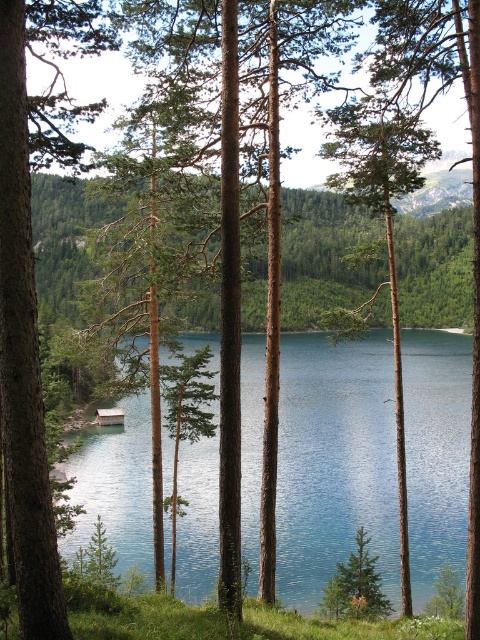
Question: Is green matte pine forest at center behind green rough bark tree at center?

Choices:
 (A) yes
 (B) no

Answer: (A)

Question: Does green matte pine forest at center appear on the right side of green rough bark tree at center?

Choices:
 (A) no
 (B) yes

Answer: (A)

Question: Which of the following is the closest to the observer?

Choices:
 (A) green matte pine forest at center
 (B) blue glassy water at center
 (C) green rough bark tree at center

Answer: (C)

Question: Which of the following is the farthest from the observer?

Choices:
 (A) (467, 454)
 (B) (379, 156)
 (C) (184, 316)

Answer: (C)

Question: Is blue glassy water at center further to the viewer compared to green rough bark tree at center?

Choices:
 (A) no
 (B) yes

Answer: (B)

Question: Which point is closer to the camera?

Choices:
 (A) green matte pine forest at center
 (B) green rough bark tree at center

Answer: (B)